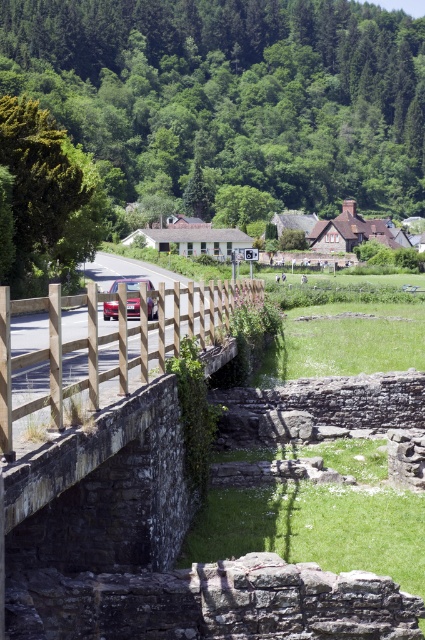
Is stone bridge at center smaller than metallic pink car at center?

Yes.

Between point (261, 289) and point (133, 278), which one is positioned in front?

Point (261, 289)

This screenshot has width=425, height=640. I want to click on stone bridge at center, so click(x=104, y=492).